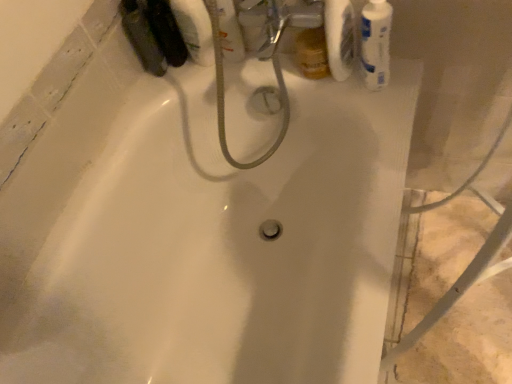
The image size is (512, 384). In order to click on vacant area to the right of matte black bottle at upper left, the third mouthwash in the right-to-left sequence in this screenshot , I will do (x=205, y=59).